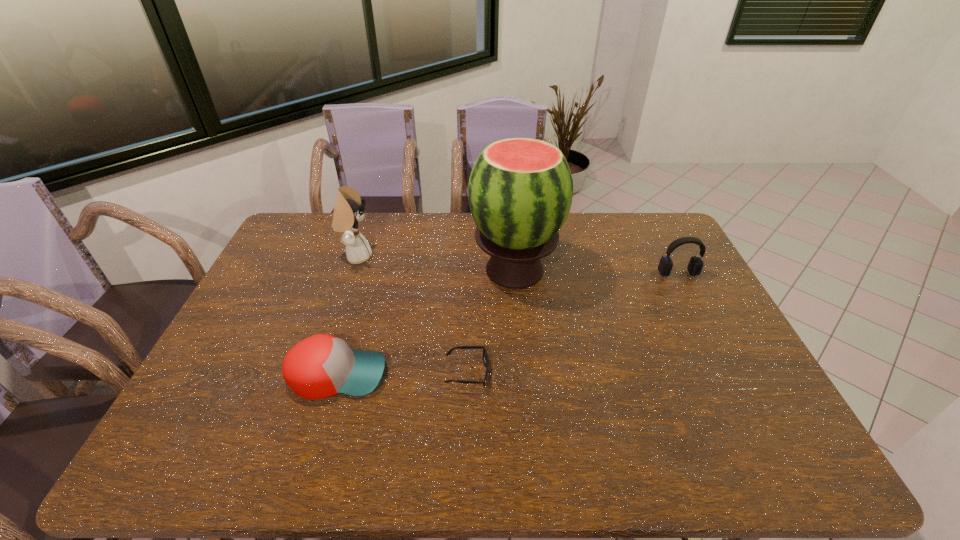
Find the location of a particular element. Image resolution: width=960 pixels, height=540 pixels. the tallest object is located at coordinates (520, 190).

You are a GUI agent. You are given a task and a screenshot of the screen. Output one action in this format:
    pyautogui.click(x=<x>, y=<y>)
    Task: Click on the second tallest object
    Image resolution: width=960 pixels, height=540 pixels.
    Given the screenshot: What is the action you would take?
    pyautogui.click(x=348, y=211)

Where is `the third tallest object`? This screenshot has height=540, width=960. the third tallest object is located at coordinates (695, 265).

Where is `headset`? The width and height of the screenshot is (960, 540). headset is located at coordinates (695, 265).

Where is `baseball cap`? This screenshot has height=540, width=960. baseball cap is located at coordinates (320, 366).

Where is `the shortest object`? The image size is (960, 540). the shortest object is located at coordinates (485, 356).

Image resolution: width=960 pixels, height=540 pixels. I want to click on vacant area located on the right of the tallest object, so click(664, 270).

Where is `blank space located 0.120m at the front face of the second tallest object`? blank space located 0.120m at the front face of the second tallest object is located at coordinates (407, 256).

Locate an element on the screen. Image resolution: width=960 pixels, height=540 pixels. blank space located 0.060m on the headband of the third shortest object is located at coordinates pyautogui.click(x=687, y=292).

Identify the location of vacant space located 0.330m at the brim of the fourth tallest object. The image size is (960, 540). (512, 374).